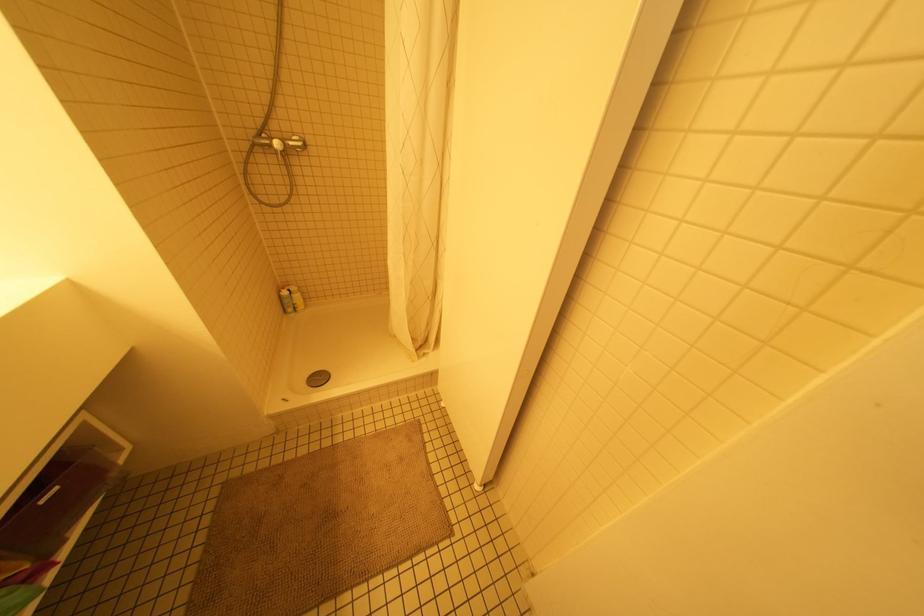
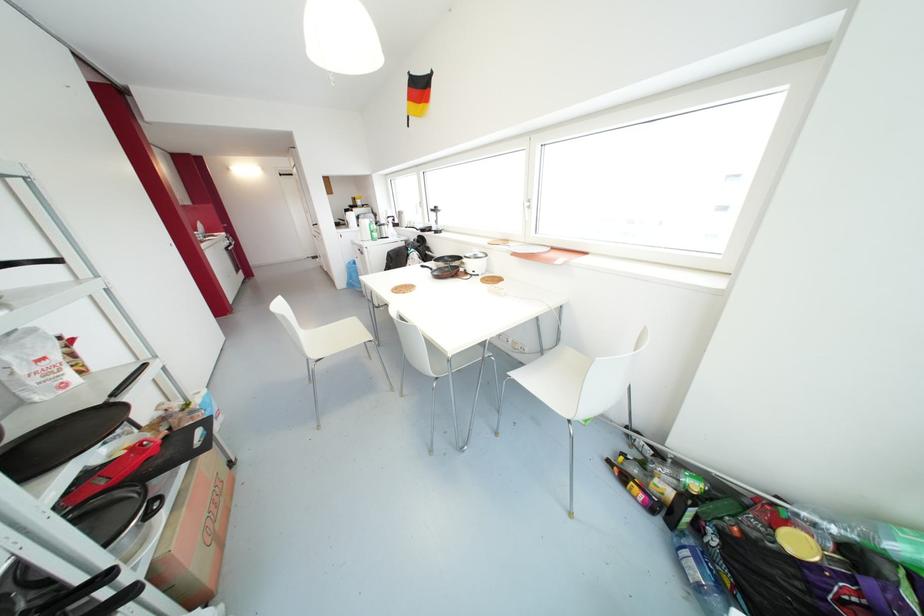
Question: I am providing you with two images of the same scene from different viewpoints. Please identify which objects are invisible in image2.

Choices:
 (A) white chair sitting surface
 (B) round drain cover
 (C) green plastic bottle
 (D) dark grey sofa sitting surface

Answer: (B)